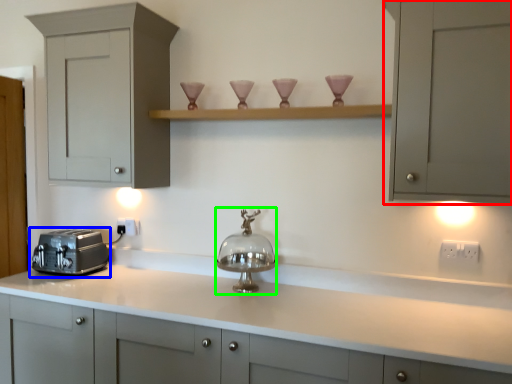
Question: Based on their relative distances, which object is nearer to cabinetry (highlighted by a red box)? Choose from toaster (highlighted by a blue box) and appliance (highlighted by a green box).

Choices:
 (A) toaster
 (B) appliance

Answer: (B)